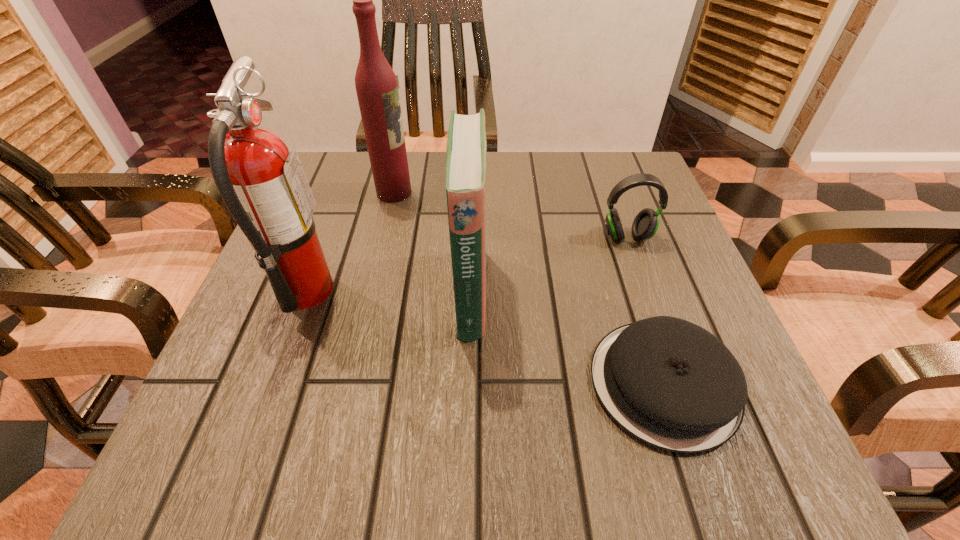
The width and height of the screenshot is (960, 540). I want to click on free area in between the headset and the fourth object from right to left, so click(511, 214).

The height and width of the screenshot is (540, 960). What are the coordinates of `free space that is in between the second object from left to right and the headset` in the screenshot? It's located at [511, 214].

Identify the location of free space between the pancake and the leftmost object. Image resolution: width=960 pixels, height=540 pixels. (485, 337).

Point out which object is positioned as the fourth nearest to the second farthest object. Please provide its 2D coordinates. Your answer should be formatted as a tuple, i.e. [(x, y)], where the tuple contains the x and y coordinates of a point satisfying the conditions above.

[(263, 185)]

Identify which object is located as the second nearest to the fourth object from right to left. Please provide its 2D coordinates. Your answer should be formatted as a tuple, i.e. [(x, y)], where the tuple contains the x and y coordinates of a point satisfying the conditions above.

[(466, 145)]

Locate an element on the screen. The height and width of the screenshot is (540, 960). blank space that satisfies the following two spatial constraints: 1. on the back side of the pancake; 2. on the cover of the third object from right to left is located at coordinates (635, 292).

Locate an element on the screen. vacant point that satisfies the following two spatial constraints: 1. on the nozzle side of the leftmost object; 2. on the left side of the pancake is located at coordinates pyautogui.click(x=271, y=383).

At what (x,y) coordinates should I click in order to perform the action: click on vacant space that satisfies the following two spatial constraints: 1. on the label of the shortest object; 2. on the left side of the farthest object. Please return your answer as a coordinate pair (x, y). The width and height of the screenshot is (960, 540). Looking at the image, I should click on (350, 383).

The width and height of the screenshot is (960, 540). What are the coordinates of `free spot that satisfies the following two spatial constraints: 1. on the nozzle side of the shortest object; 2. on the left side of the fire extinguisher` in the screenshot? It's located at (271, 383).

At what (x,y) coordinates should I click in order to perform the action: click on vacant space that satisfies the following two spatial constraints: 1. on the label of the farthest object; 2. on the left side of the pancake. Please return your answer as a coordinate pair (x, y). Looking at the image, I should click on (350, 383).